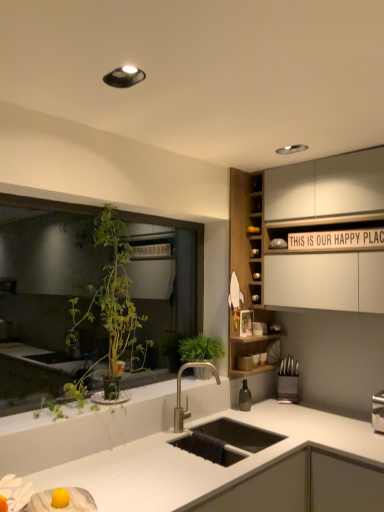
Identify the location of blank space to the left of black plastic knife block at right. (265, 403).